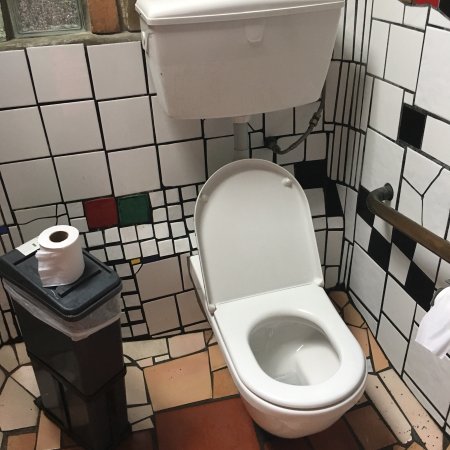
Locate an element on the screen. black wall tiles is located at coordinates (417, 280), (414, 114), (364, 202), (316, 173), (332, 204), (379, 250), (408, 238).